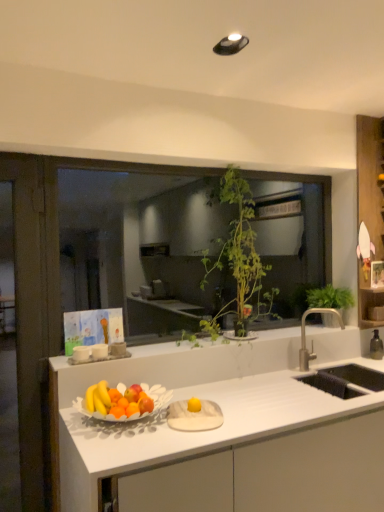
Question: Is green leafy plant at center facing away from green leafy plant at upper right, placed as the 2th houseplant when sorted from left to right?

Choices:
 (A) no
 (B) yes

Answer: (B)

Question: Is green leafy plant at center to the left of green leafy plant at upper right, placed as the 2th houseplant when sorted from left to right, from the viewer's perspective?

Choices:
 (A) yes
 (B) no

Answer: (A)

Question: Does green leafy plant at center have a smaller size compared to green leafy plant at upper right, which appears as the 1th houseplant when viewed from the right?

Choices:
 (A) yes
 (B) no

Answer: (B)

Question: Is there a large distance between green leafy plant at center and green leafy plant at upper right, which appears as the 1th houseplant when viewed from the right?

Choices:
 (A) no
 (B) yes

Answer: (B)

Question: Does green leafy plant at center contain green leafy plant at upper right, which appears as the 1th houseplant when viewed from the right?

Choices:
 (A) no
 (B) yes

Answer: (A)

Question: Is green leafy plant at center shorter than green leafy plant at upper right, placed as the 2th houseplant when sorted from left to right?

Choices:
 (A) no
 (B) yes

Answer: (A)

Question: From a real-world perspective, is wooden shelf at right positioned under matte white bowl of fruits at center based on gravity?

Choices:
 (A) yes
 (B) no

Answer: (B)

Question: Is wooden shelf at right aimed at matte white bowl of fruits at center?

Choices:
 (A) yes
 (B) no

Answer: (A)

Question: From a real-world perspective, is wooden shelf at right located higher than matte white bowl of fruits at center?

Choices:
 (A) yes
 (B) no

Answer: (A)

Question: Is there a large distance between wooden shelf at right and matte white bowl of fruits at center?

Choices:
 (A) no
 (B) yes

Answer: (B)

Question: Can you confirm if wooden shelf at right is smaller than matte white bowl of fruits at center?

Choices:
 (A) no
 (B) yes

Answer: (A)

Question: Is wooden shelf at right to the right of matte white bowl of fruits at center from the viewer's perspective?

Choices:
 (A) no
 (B) yes

Answer: (B)

Question: Does green leafy plant at center, which is counted as the 2th houseplant, starting from the right, appear on the right side of wooden shelf at right?

Choices:
 (A) no
 (B) yes

Answer: (A)